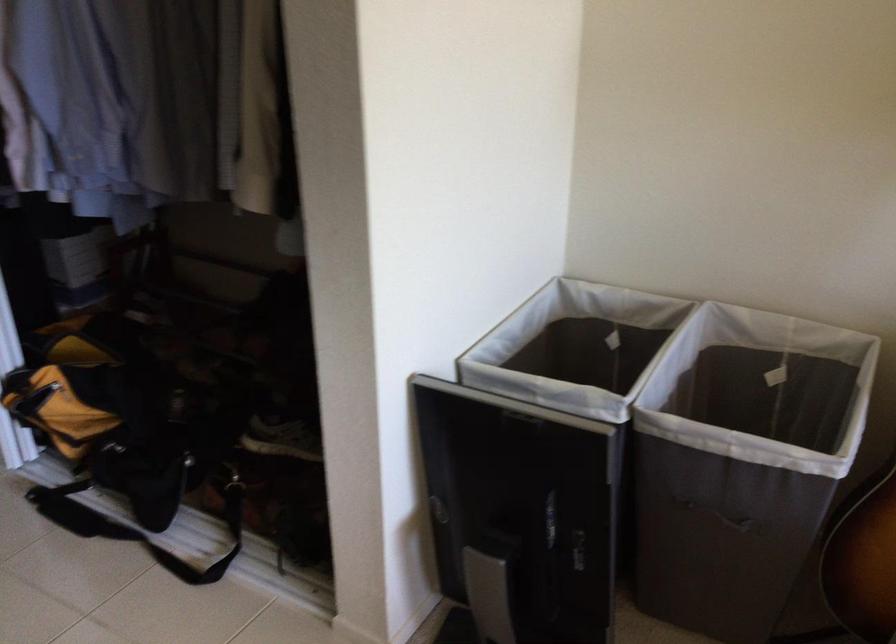
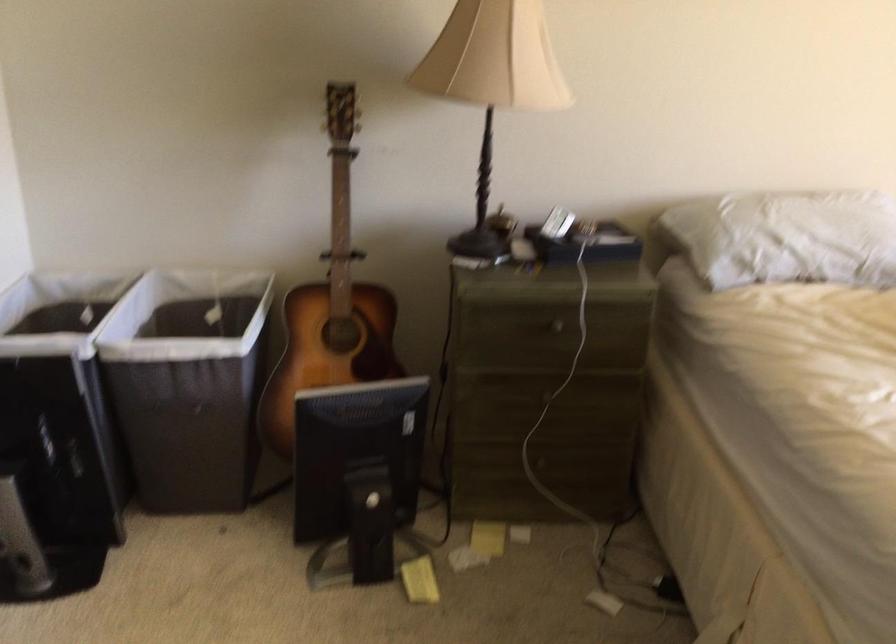
In the second image, find the point that corresponds to pixel 580 323 in the first image.

(57, 310)